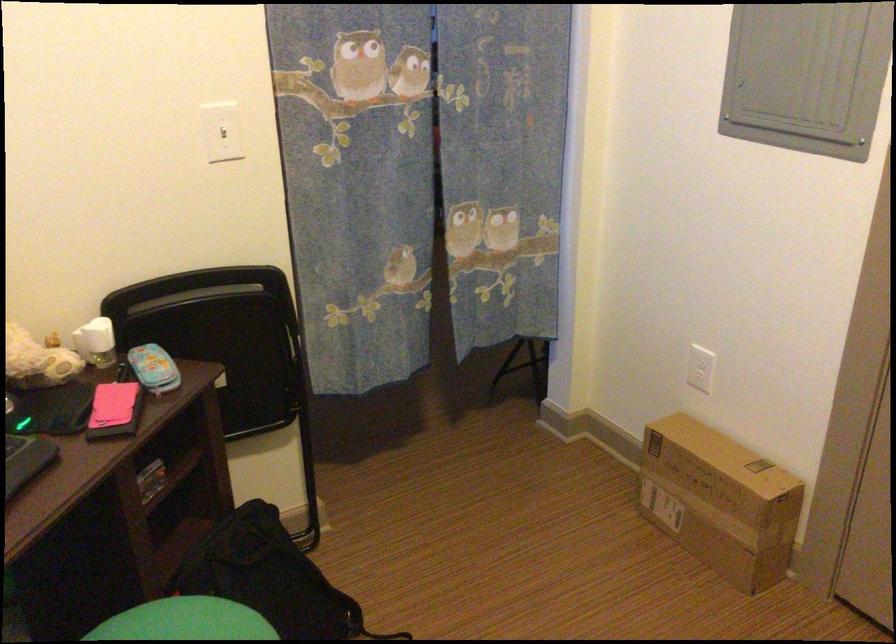
Find where to lift the patterned blue pouch. Please return your answer as a coordinate pair (x, y).

(153, 368)